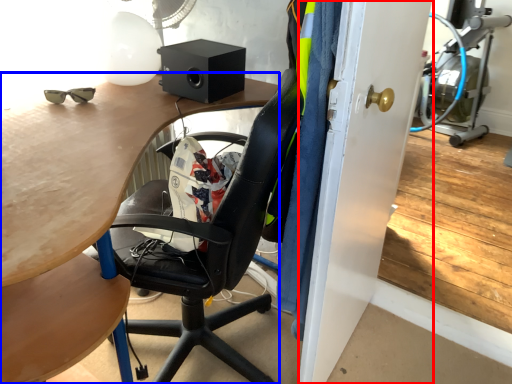
Question: Among these objects, which one is farthest to the camera, glass door (highlighted by a red box) or desk (highlighted by a blue box)?

Choices:
 (A) glass door
 (B) desk

Answer: (A)